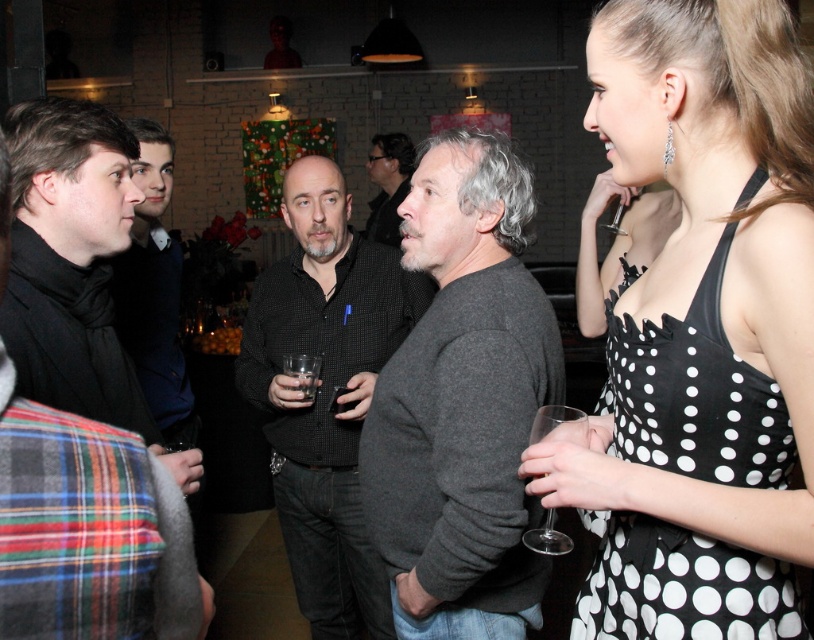
You are at a party and want to grab a drink. You see the black wool scarf at left and the clear glass wine glass at lower right. Which object is closer to your left side?

The black wool scarf at left is positioned on the left side of clear glass wine glass at lower right, so the black wool scarf at left is closer to your left side.

You are at a party and want to grab a drink. You see two glasses on the table in front of you. The clear glass wine glass at lower right and the transparent glass at center. Which glass is positioned more to the right side of the table?

The clear glass wine glass at lower right is positioned more to the right side of the table compared to the transparent glass at center.